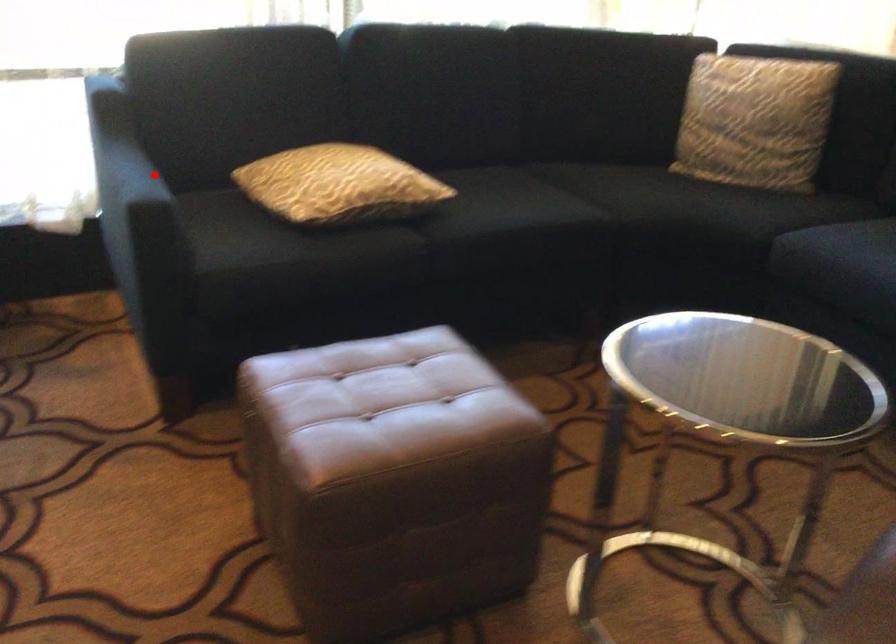
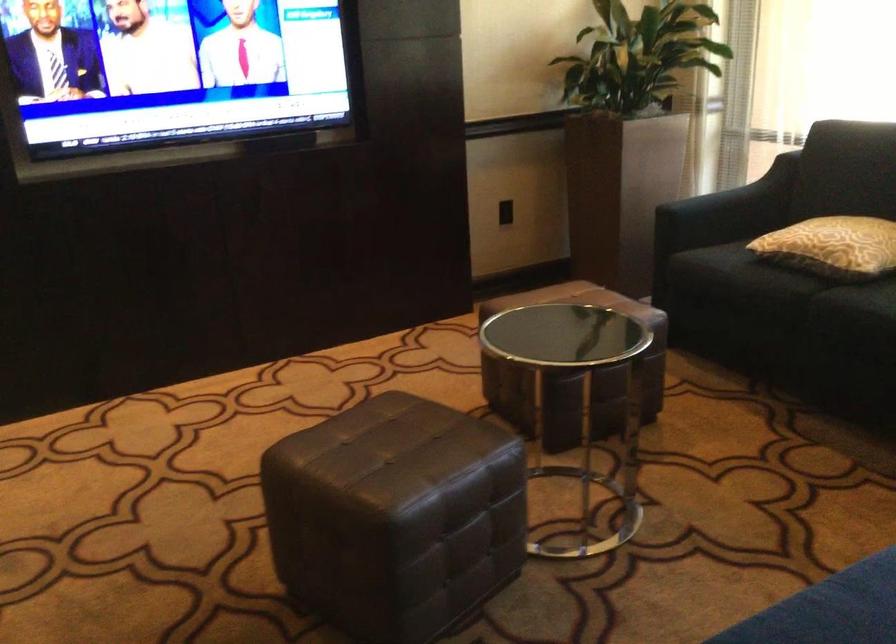
Question: A red point is marked in image1. In image2, is the corresponding 3D point closer to the camera or farther? Reply with the corresponding letter.

Choices:
 (A) The corresponding 3D point is closer.
 (B) The corresponding 3D point is farther.

Answer: (B)